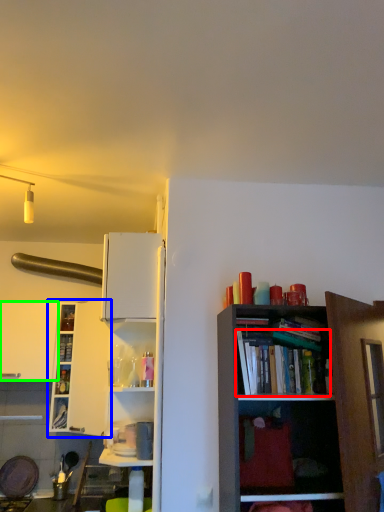
Question: Which is nearer to the book (highlighted by a red box)? shelf (highlighted by a blue box) or cabinetry (highlighted by a green box).

Choices:
 (A) shelf
 (B) cabinetry

Answer: (A)